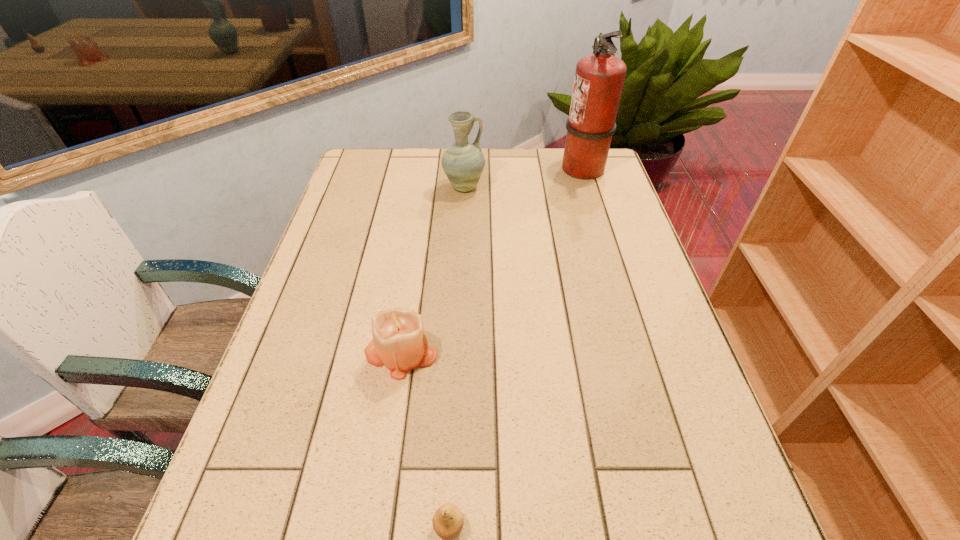
The width and height of the screenshot is (960, 540). In order to click on vacant area that lies between the third farthest object and the third shortest object in this screenshot , I will do `click(432, 269)`.

Find the location of a particular element. The width and height of the screenshot is (960, 540). vacant area that lies between the tallest object and the pitcher is located at coordinates (523, 178).

You are a GUI agent. You are given a task and a screenshot of the screen. Output one action in this format:
    pyautogui.click(x=<x>, y=<y>)
    Task: Click on the object that stands as the closest to the tallest object
    The height and width of the screenshot is (540, 960).
    Given the screenshot: What is the action you would take?
    pyautogui.click(x=463, y=162)

Select which object appears as the second closest to the pitcher. Please provide its 2D coordinates. Your answer should be formatted as a tuple, i.e. [(x, y)], where the tuple contains the x and y coordinates of a point satisfying the conditions above.

[(399, 342)]

Where is `vacant space that satisfies the following two spatial constraints: 1. toward the nozzle of the tallest object; 2. on the front side of the third farthest object`? The image size is (960, 540). vacant space that satisfies the following two spatial constraints: 1. toward the nozzle of the tallest object; 2. on the front side of the third farthest object is located at coordinates (639, 352).

You are a GUI agent. You are given a task and a screenshot of the screen. Output one action in this format:
    pyautogui.click(x=<x>, y=<y>)
    Task: Click on the vacant space that satisfies the following two spatial constraints: 1. on the handle side of the pitcher; 2. on the front side of the candle
    
    Given the screenshot: What is the action you would take?
    pyautogui.click(x=457, y=352)